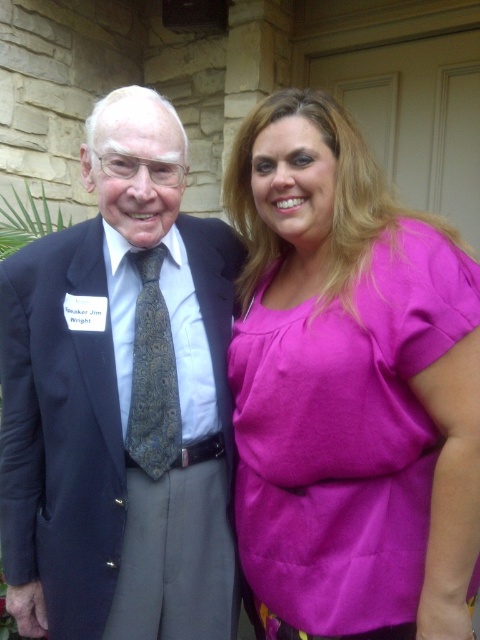
Is point (277, 228) positioned in front of point (146, 324)?

No, (277, 228) is behind (146, 324).

Is point (363, 451) closer to camera compared to point (146, 337)?

Yes, it is.

Image resolution: width=480 pixels, height=640 pixels. I want to click on pink fabric blouse at right, so click(x=349, y=388).

Which is more to the left, matte black suit at left or dark gray paisley tie at center?

matte black suit at left

Is matte black suit at left smaller than dark gray paisley tie at center?

No.

Is point (51, 419) positioned after point (171, 397)?

No.

Locate an element on the screen. matte black suit at left is located at coordinates (120, 401).

Between pink fabric blouse at right and matte black suit at left, which one is positioned higher?

pink fabric blouse at right is above.

Who is more distant from viewer, (289,536) or (104,364)?

The point (104,364) is behind.

I want to click on pink fabric blouse at right, so click(349, 388).